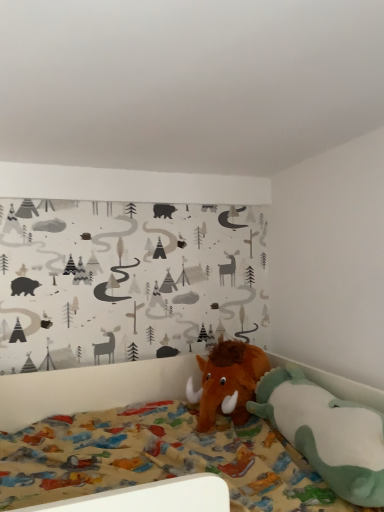
Question: From their relative heights in the image, would you say brown plush mammoth at lower right, which is the second toy in back-to-front order, is taller or shorter than brown plush mammoth at center, which is the second toy from front to back?

Choices:
 (A) short
 (B) tall

Answer: (A)

Question: Does point (264, 397) appear closer or farther from the camera than point (249, 354)?

Choices:
 (A) farther
 (B) closer

Answer: (B)

Question: From the image's perspective, relative to brown plush mammoth at center, which is the first toy in back-to-front order, is brown plush mammoth at lower right, arranged as the first toy when viewed from the front, above or below?

Choices:
 (A) above
 (B) below

Answer: (B)

Question: Is point (241, 350) positioned closer to the camera than point (304, 443)?

Choices:
 (A) farther
 (B) closer

Answer: (A)

Question: Looking at their shapes, would you say brown plush mammoth at center, which is the first toy in back-to-front order, is wider or thinner than brown plush mammoth at lower right, which is the second toy in back-to-front order?

Choices:
 (A) wide
 (B) thin

Answer: (A)

Question: From a real-world perspective, relative to brown plush mammoth at lower right, which is the second toy in back-to-front order, is brown plush mammoth at center, which is the second toy from front to back, vertically above or below?

Choices:
 (A) below
 (B) above

Answer: (B)

Question: Is brown plush mammoth at center, which is the second toy from front to back, situated inside brown plush mammoth at lower right, which is the second toy in back-to-front order, or outside?

Choices:
 (A) inside
 (B) outside

Answer: (B)